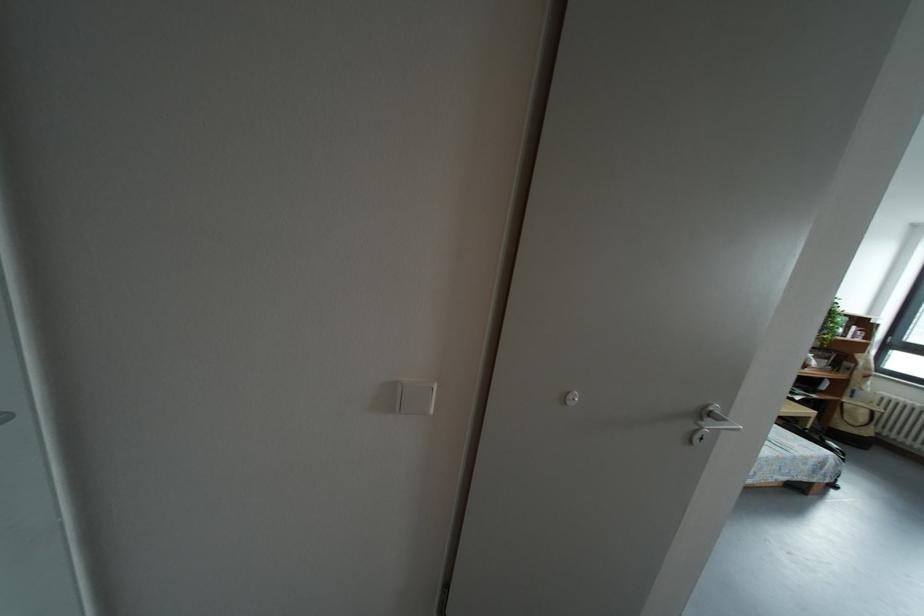
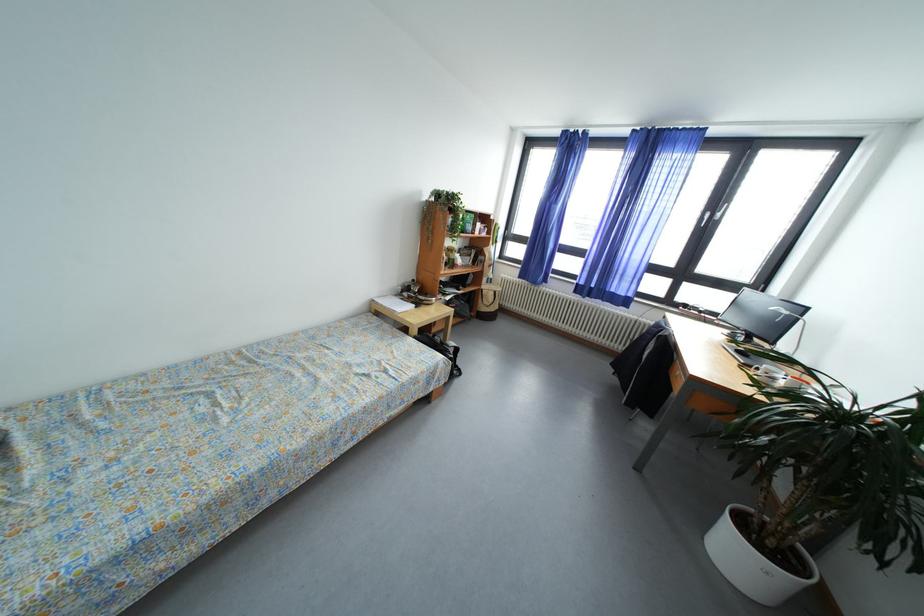
Where in the second image is the point corresponding to pixel 847 325 from the first image?

(477, 223)